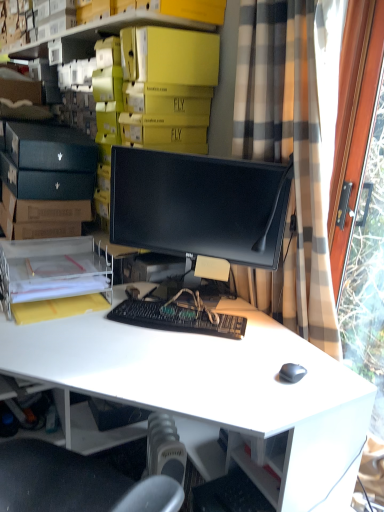
Question: From a real-world perspective, is black matte keyboard at center positioned over plaid fabric curtain at right based on gravity?

Choices:
 (A) no
 (B) yes

Answer: (A)

Question: Is black matte keyboard at center bigger than plaid fabric curtain at right?

Choices:
 (A) yes
 (B) no

Answer: (B)

Question: Considering the relative sizes of black matte keyboard at center and plaid fabric curtain at right in the image provided, is black matte keyboard at center wider than plaid fabric curtain at right?

Choices:
 (A) yes
 (B) no

Answer: (B)

Question: Could plaid fabric curtain at right be considered to be inside black matte keyboard at center?

Choices:
 (A) yes
 (B) no

Answer: (B)

Question: Is black matte keyboard at center smaller than plaid fabric curtain at right?

Choices:
 (A) yes
 (B) no

Answer: (A)

Question: Is black matte keyboard at center in front of plaid fabric curtain at right?

Choices:
 (A) no
 (B) yes

Answer: (A)

Question: Does plaid fabric curtain at right have a lesser width compared to white matte desk at center?

Choices:
 (A) yes
 (B) no

Answer: (A)

Question: Is plaid fabric curtain at right not near white matte desk at center?

Choices:
 (A) no
 (B) yes

Answer: (A)

Question: Considering the relative sizes of plaid fabric curtain at right and white matte desk at center in the image provided, is plaid fabric curtain at right smaller than white matte desk at center?

Choices:
 (A) yes
 (B) no

Answer: (A)

Question: Is the depth of plaid fabric curtain at right greater than that of white matte desk at center?

Choices:
 (A) no
 (B) yes

Answer: (B)

Question: Does plaid fabric curtain at right have a larger size compared to white matte desk at center?

Choices:
 (A) no
 (B) yes

Answer: (A)

Question: From a real-world perspective, is plaid fabric curtain at right over white matte desk at center?

Choices:
 (A) yes
 (B) no

Answer: (A)

Question: Would you consider clear plastic file at lower left to be distant from yellow cardboard boxes at upper center?

Choices:
 (A) yes
 (B) no

Answer: (B)